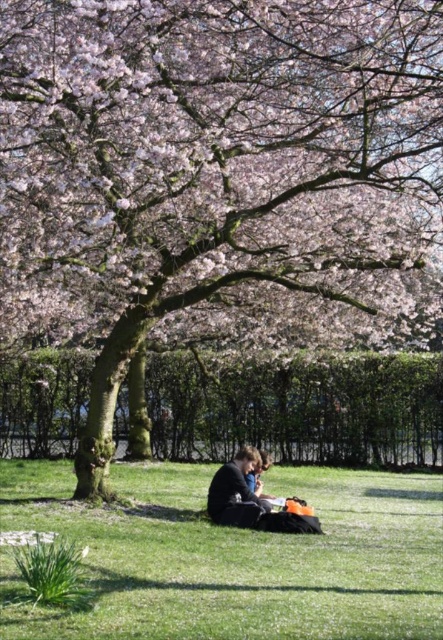
Which is behind, point (326, 493) or point (240, 468)?

The point (326, 493) is behind.

Measure the distance between green grass at center and camera.

A distance of 5.61 meters exists between green grass at center and camera.

Measure the distance between green grass at center and camera.

A distance of 18.42 feet exists between green grass at center and camera.

At what (x,y) coordinates should I click in order to perform the action: click on green grass at center. Please return your answer as a coordinate pair (x, y). Looking at the image, I should click on (237, 556).